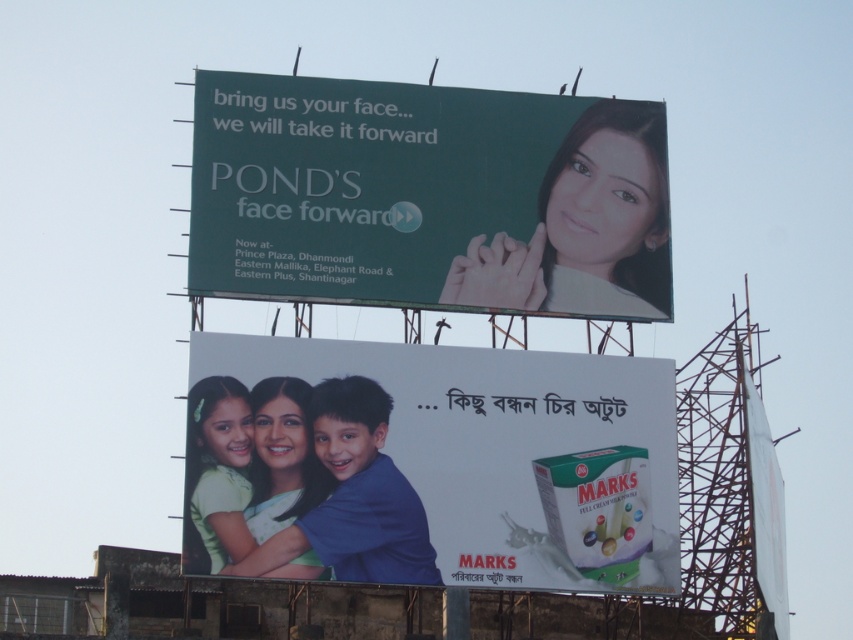
You are a delivery person who just arrived at the billboard site. You have a white cardboard box at center that needs to be placed on top of the green matte billboard at upper center. Can you fit the box on the billboard?

The white cardboard box at center has a smaller size compared to green matte billboard at upper center, so it can fit on the billboard.

You are a delivery person trying to deliver a package to the smooth skin face at upper right. The green matte billboard at upper center is blocking your path. Can you go around it to reach your destination?

The green matte billboard at upper center is in front of the smooth skin face at upper right, so you cannot go around it directly. You might need to find an alternative route or move the billboard temporarily to access the smooth skin face at upper right.

You are a delivery person standing at the camera position. You need to place a white cardboard box at center that is 1.2 meters in length. Can you safely place it without it being too close to the camera? Explain why.

The white cardboard box at center is 79.47 meters away from the camera. Since the box is 1.2 meters long, placing it at that distance would mean it is sufficiently far away and not too close to the camera.